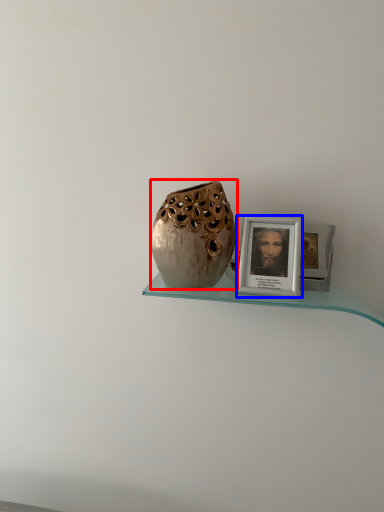
Question: Which of the following is the closest to the observer, vase (highlighted by a red box) or picture frame (highlighted by a blue box)?

Choices:
 (A) vase
 (B) picture frame

Answer: (A)